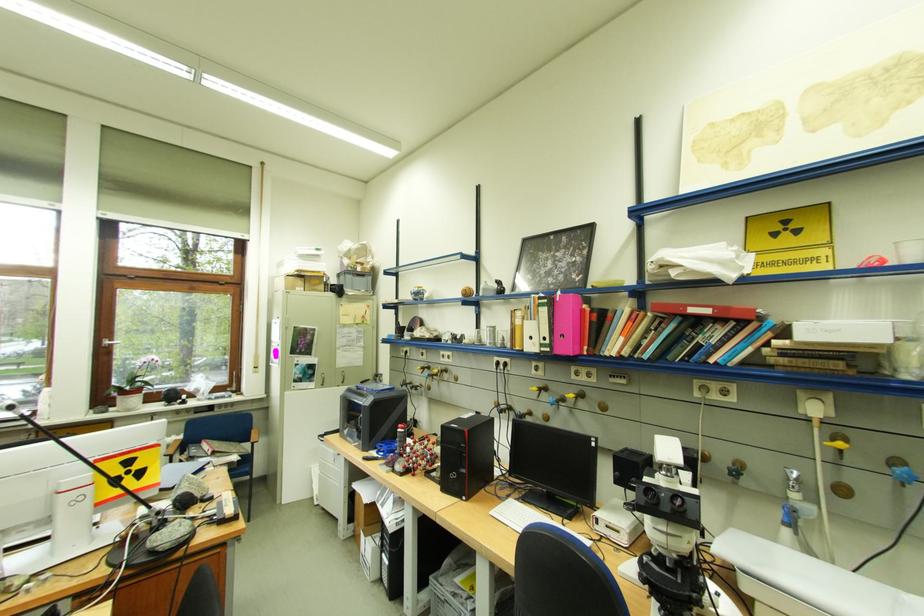
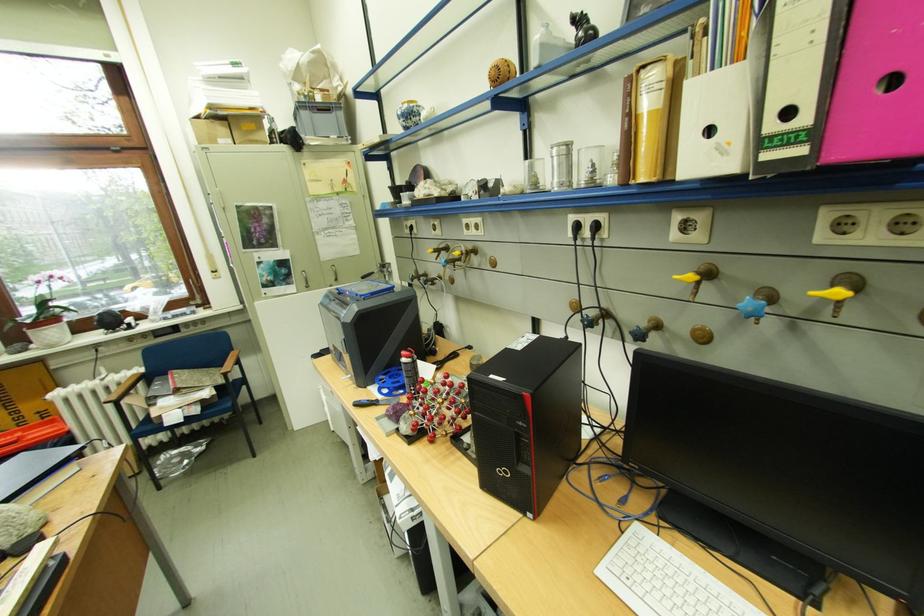
Where in the second image is the point corresponding to point (544, 390) from the first image?

(700, 277)